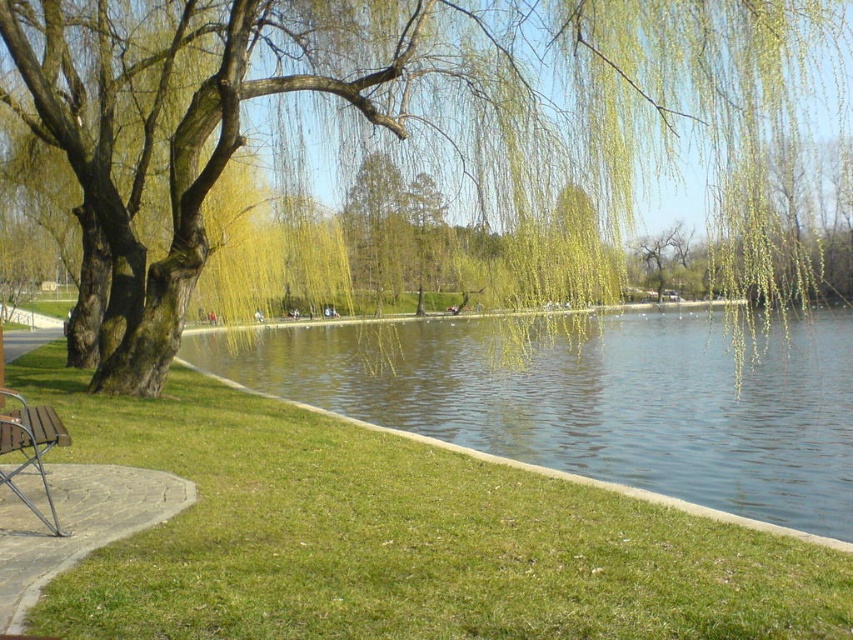
You are a park visitor who wants to take a photo of the wooden bench at lower left without the green leafy willow at upper center blocking the view. Is it possible to position yourself in such a way that the bench is visible but the willow is not in the frame?

The green leafy willow at upper center is taller than the wooden bench at lower left, so if you position yourself lower or move closer to the bench, you can frame the photo so the bench is visible while the willow is out of the shot.

You are standing at the entrance of the park and want to find the green leafy willow at upper center. Based on the park layout, where should you look relative to the center of the image?

The green leafy willow at upper center is located at the coordinates 0.156 on the x axis and 0.429 on the y axis, so you should look slightly to the left and above the center of the image.

You are a park visitor who wants to sit on the wooden bench near the green leafy willow at upper center. Can you see the green liquid water at center from there?

Yes, because the green leafy willow at upper center is positioned over the green liquid water at center, so sitting on the bench near the willow would allow you to see the water below.